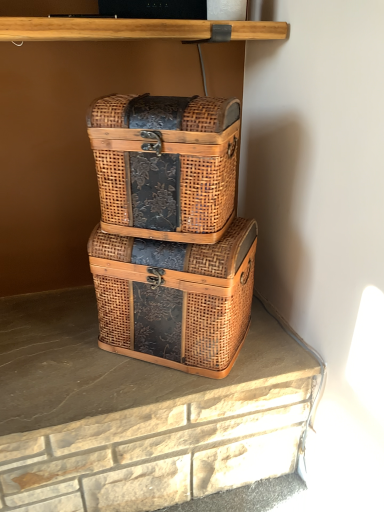
Question: Does point (235, 151) appear closer or farther from the camera than point (112, 239)?

Choices:
 (A) farther
 (B) closer

Answer: (B)

Question: Based on their sizes in the image, would you say woven wood box at center, which ranks as the 2th box in bottom-to-top order, is bigger or smaller than woven wood box at center, which ranks as the 1th box in bottom-to-top order?

Choices:
 (A) small
 (B) big

Answer: (A)

Question: Looking at their shapes, would you say woven wood box at center, which ranks as the 2th box in bottom-to-top order, is wider or thinner than woven wood box at center, the second box viewed from the top?

Choices:
 (A) wide
 (B) thin

Answer: (B)

Question: Considering the positions of woven wood box at center, which ranks as the 1th box in bottom-to-top order, and woven wood box at center, the first box from the top, in the image, is woven wood box at center, which ranks as the 1th box in bottom-to-top order, bigger or smaller than woven wood box at center, the first box from the top,?

Choices:
 (A) small
 (B) big

Answer: (B)

Question: Is woven wood box at center, the second box viewed from the top, situated inside woven wood box at center, which ranks as the 2th box in bottom-to-top order, or outside?

Choices:
 (A) outside
 (B) inside

Answer: (A)

Question: From the image's perspective, is woven wood box at center, which ranks as the 1th box in bottom-to-top order, above or below woven wood box at center, the first box from the top?

Choices:
 (A) above
 (B) below

Answer: (B)

Question: Would you say woven wood box at center, the second box viewed from the top, is to the left or to the right of woven wood box at center, the first box from the top, in the picture?

Choices:
 (A) left
 (B) right

Answer: (B)